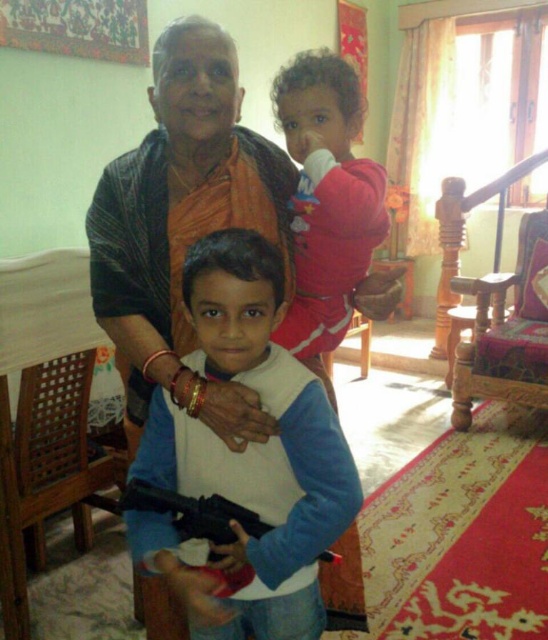
Question: Among these points, which one is farthest from the camera?

Choices:
 (A) (135, 484)
 (B) (142, 205)
 (C) (184, 484)
 (D) (288, 342)

Answer: (D)

Question: Among these objects, which one is farthest from the camera?

Choices:
 (A) fluffy pink sweater at upper right
 (B) orange saree at center
 (C) white matte vest at center

Answer: (A)

Question: Which point is farther to the camera?

Choices:
 (A) white matte vest at center
 (B) orange saree at center
 (C) fluffy pink sweater at upper right
 (D) black plastic gun at center

Answer: (C)

Question: Is the position of white matte vest at center more distant than that of fluffy pink sweater at upper right?

Choices:
 (A) yes
 (B) no

Answer: (B)

Question: Does white matte vest at center have a larger size compared to orange saree at center?

Choices:
 (A) yes
 (B) no

Answer: (B)

Question: Can you confirm if fluffy pink sweater at upper right is wider than black plastic gun at center?

Choices:
 (A) no
 (B) yes

Answer: (A)